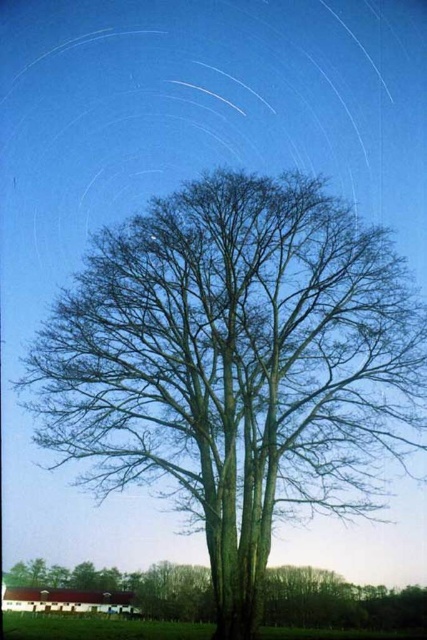
Can you confirm if brown textured tree at center is thinner than green matte tree at center?

Yes.

Which is above, brown textured tree at center or green matte tree at center?

brown textured tree at center is above.

Describe the element at coordinates (236, 365) in the screenshot. I see `brown textured tree at center` at that location.

What are the coordinates of `brown textured tree at center` in the screenshot? It's located at (236, 365).